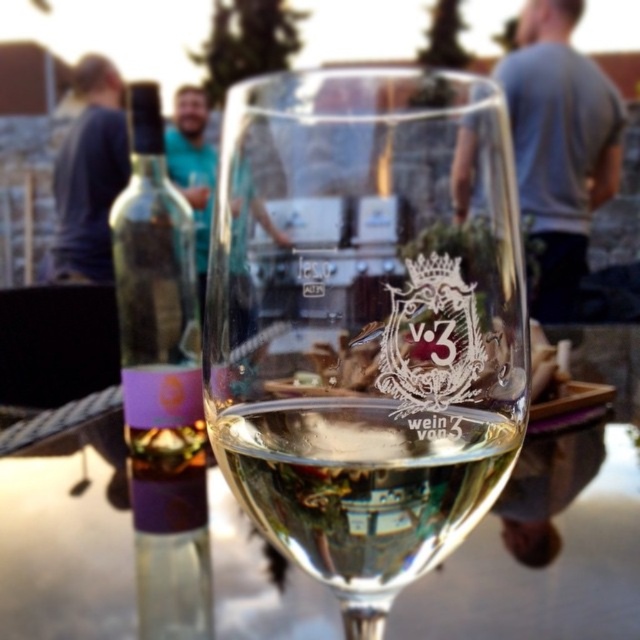
You are looking at the image and want to determine which of the two points, point (x=496, y=292) or point (x=600, y=70), is nearer to you. Based on the spatial relationships in the scene, which point is closer?

Point (x=496, y=292) is closer to the camera than point (x=600, y=70), so the first point is closer to you.

You are at a party and want to pour the translucent glass bottle at left into the clear glass wine at center. Will the bottle fit into the glass?

The clear glass wine at center is wider than the translucent glass bottle at left, so the bottle should fit into the glass.

You are at a party and want to know if the clear glass wine glass at center can fit into the pocket of the blue fabric shirt at upper left. Based on their sizes, what do you think?

The clear glass wine glass at center is larger in size than the blue fabric shirt at upper left, so it likely cannot fit into the shirt pocket.